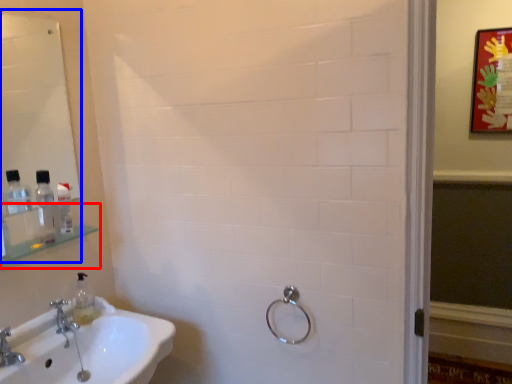
Question: Among these objects, which one is farthest to the camera, shelf (highlighted by a red box) or mirror (highlighted by a blue box)?

Choices:
 (A) shelf
 (B) mirror

Answer: (A)